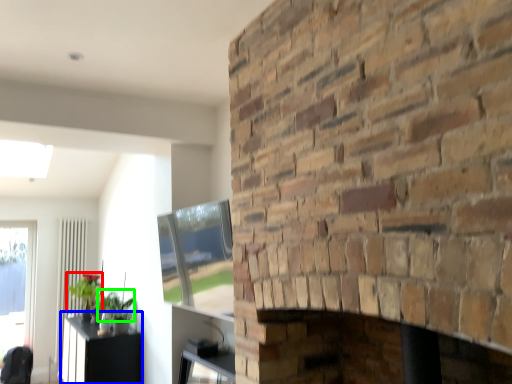
Question: Estimate the real-world distances between objects in this image. Which object is closer to plant (highlighted by a red box), table (highlighted by a blue box) or plant (highlighted by a green box)?

Choices:
 (A) table
 (B) plant

Answer: (B)